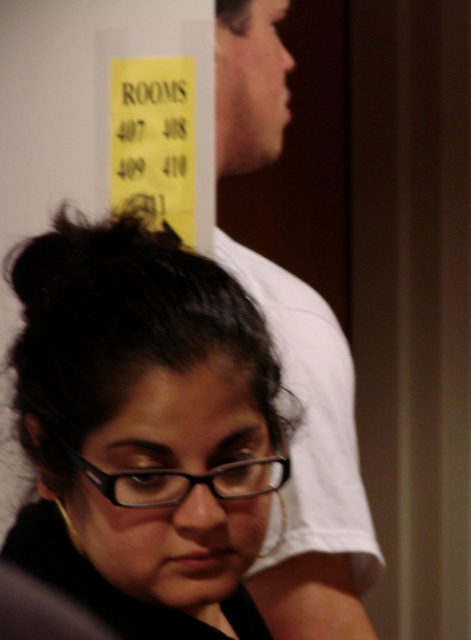
Question: Where is black matte hair at center located in relation to black plastic glasses at lower center in the image?

Choices:
 (A) right
 (B) left

Answer: (B)

Question: Which object is farther from the camera taking this photo?

Choices:
 (A) black plastic glasses at lower center
 (B) white cotton shirt at upper right
 (C) black matte hair at center

Answer: (B)

Question: Does black matte hair at center have a larger size compared to white cotton shirt at upper right?

Choices:
 (A) no
 (B) yes

Answer: (A)

Question: Which object is farther from the camera taking this photo?

Choices:
 (A) white cotton shirt at upper right
 (B) black plastic glasses at lower center
 (C) black matte hair at center

Answer: (A)

Question: Can you confirm if white cotton shirt at upper right is wider than black plastic glasses at lower center?

Choices:
 (A) no
 (B) yes

Answer: (B)

Question: Which object is closer to the camera taking this photo?

Choices:
 (A) black plastic glasses at lower center
 (B) white cotton shirt at upper right
 (C) black matte hair at center

Answer: (C)